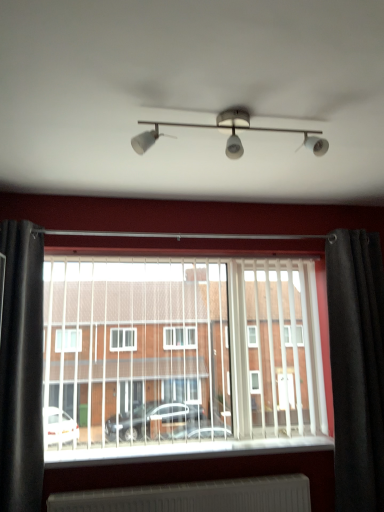
In order to face black fabric curtain at left, the second curtain positioned from the right, should I rotate leftwards or rightwards?

You should look left and rotate roughly 22.227 degrees.

What do you see at coordinates (179, 355) in the screenshot?
I see `white plastic blinds at center` at bounding box center [179, 355].

Image resolution: width=384 pixels, height=512 pixels. What do you see at coordinates (188, 450) in the screenshot?
I see `white plastic window sill at center` at bounding box center [188, 450].

Describe the element at coordinates (357, 367) in the screenshot. The image size is (384, 512). I see `black velvet curtain at right, marked as the first curtain in a right-to-left arrangement` at that location.

At what (x,y) coordinates should I click in order to perform the action: click on black fabric curtain at left, the second curtain positioned from the right. Please return your answer as a coordinate pair (x, y). Looking at the image, I should click on (21, 368).

Is black velvet curtain at right, marked as the first curtain in a right-to-left arrangement, not within white plastic blinds at center?

Yes, black velvet curtain at right, marked as the first curtain in a right-to-left arrangement, is not within white plastic blinds at center.

In order to click on window above the black velvet curtain at right, which ranks as the second curtain in left-to-right order (from the image's perspective) in this screenshot , I will do `click(179, 355)`.

How far apart are black velvet curtain at right, which ranks as the second curtain in left-to-right order, and white plastic blinds at center?

The distance of black velvet curtain at right, which ranks as the second curtain in left-to-right order, from white plastic blinds at center is 29.37 inches.

Based on the photo, are black velvet curtain at right, which ranks as the second curtain in left-to-right order, and white plastic blinds at center far apart?

No, black velvet curtain at right, which ranks as the second curtain in left-to-right order, is not far from white plastic blinds at center.

Image resolution: width=384 pixels, height=512 pixels. Find the location of `curtain on the right side of black fabric curtain at left, the first curtain viewed from the left`. curtain on the right side of black fabric curtain at left, the first curtain viewed from the left is located at coordinates (357, 367).

From the image's perspective, is black fabric curtain at left, the first curtain viewed from the left, beneath black velvet curtain at right, marked as the first curtain in a right-to-left arrangement?

Incorrect, from the image's perspective, black fabric curtain at left, the first curtain viewed from the left, is higher than black velvet curtain at right, marked as the first curtain in a right-to-left arrangement.

Between black fabric curtain at left, the second curtain positioned from the right, and black velvet curtain at right, marked as the first curtain in a right-to-left arrangement, which one has larger width?

With larger width is black velvet curtain at right, marked as the first curtain in a right-to-left arrangement.

In the image, is black fabric curtain at left, the second curtain positioned from the right, positioned in front of or behind black velvet curtain at right, which ranks as the second curtain in left-to-right order?

Clearly, black fabric curtain at left, the second curtain positioned from the right, is in front of black velvet curtain at right, which ranks as the second curtain in left-to-right order.

From the picture: Is black fabric curtain at left, the first curtain viewed from the left, oriented away from satin white track lights at center?

black fabric curtain at left, the first curtain viewed from the left, does not have its back to satin white track lights at center.

Is black fabric curtain at left, the second curtain positioned from the right, thinner than satin white track lights at center?

Incorrect, the width of black fabric curtain at left, the second curtain positioned from the right, is not less than that of satin white track lights at center.

Who is shorter, black fabric curtain at left, the second curtain positioned from the right, or satin white track lights at center?

Standing shorter between the two is satin white track lights at center.

Is satin white track lights at center inside black fabric curtain at left, the second curtain positioned from the right?

No, satin white track lights at center is not a part of black fabric curtain at left, the second curtain positioned from the right.

Locate an element on the screen. The width and height of the screenshot is (384, 512). light fixture above the white plastic blinds at center (from a real-world perspective) is located at coordinates (230, 133).

Could you tell me if white plastic blinds at center is turned towards satin white track lights at center?

Yes, white plastic blinds at center is facing satin white track lights at center.

From the image's perspective, is white plastic blinds at center above or below satin white track lights at center?

Based on their image positions, white plastic blinds at center is located beneath satin white track lights at center.

Based on the photo, is black fabric curtain at left, the first curtain viewed from the left, aimed at white plastic window sill at center?

No, black fabric curtain at left, the first curtain viewed from the left, is not facing towards white plastic window sill at center.

Considering the relative positions of black fabric curtain at left, the second curtain positioned from the right, and white plastic window sill at center in the image provided, is black fabric curtain at left, the second curtain positioned from the right, in front of white plastic window sill at center?

Yes, black fabric curtain at left, the second curtain positioned from the right, is closer to the viewer.

Choose the correct answer: Is black fabric curtain at left, the second curtain positioned from the right, inside white plastic window sill at center or outside it?

black fabric curtain at left, the second curtain positioned from the right, is located beyond the bounds of white plastic window sill at center.

Is white plastic window sill at center positioned beyond the bounds of satin white track lights at center?

Yes, white plastic window sill at center is located beyond the bounds of satin white track lights at center.

What's the angular difference between white plastic window sill at center and satin white track lights at center's facing directions?

0.0667 degrees.

From the image's perspective, which is above, white plastic window sill at center or satin white track lights at center?

satin white track lights at center is shown above in the image.

In terms of width, does black velvet curtain at right, which ranks as the second curtain in left-to-right order, look wider or thinner when compared to satin white track lights at center?

Considering their sizes, black velvet curtain at right, which ranks as the second curtain in left-to-right order, looks broader than satin white track lights at center.

Is black velvet curtain at right, marked as the first curtain in a right-to-left arrangement, far away from satin white track lights at center?

Yes.

From the image's perspective, which one is positioned lower, black velvet curtain at right, marked as the first curtain in a right-to-left arrangement, or satin white track lights at center?

black velvet curtain at right, marked as the first curtain in a right-to-left arrangement, from the image's perspective.

Is black velvet curtain at right, which ranks as the second curtain in left-to-right order, to the right of satin white track lights at center from the viewer's perspective?

Yes.

Where is `window above the black velvet curtain at right, marked as the first curtain in a right-to-left arrangement (from a real-world perspective)`? Image resolution: width=384 pixels, height=512 pixels. window above the black velvet curtain at right, marked as the first curtain in a right-to-left arrangement (from a real-world perspective) is located at coordinates (179, 355).

Locate an element on the screen. curtain in front of the black velvet curtain at right, which ranks as the second curtain in left-to-right order is located at coordinates (21, 368).

When comparing their distances from satin white track lights at center, does white plastic window sill at center or white plastic blinds at center seem closer?

The object closer to satin white track lights at center is white plastic blinds at center.

When comparing their distances from satin white track lights at center, does black velvet curtain at right, which ranks as the second curtain in left-to-right order, or black fabric curtain at left, the second curtain positioned from the right, seem further?

Among the two, black fabric curtain at left, the second curtain positioned from the right, is located further to satin white track lights at center.

Considering their positions, is white plastic window sill at center positioned further to satin white track lights at center than black velvet curtain at right, which ranks as the second curtain in left-to-right order?

Among the two, white plastic window sill at center is located further to satin white track lights at center.

Which object lies nearer to the anchor point white plastic window sill at center, black velvet curtain at right, which ranks as the second curtain in left-to-right order, or satin white track lights at center?

black velvet curtain at right, which ranks as the second curtain in left-to-right order, lies closer to white plastic window sill at center than the other object.

Which object lies further to the anchor point black velvet curtain at right, which ranks as the second curtain in left-to-right order, white plastic blinds at center or black fabric curtain at left, the second curtain positioned from the right?

black fabric curtain at left, the second curtain positioned from the right, lies further to black velvet curtain at right, which ranks as the second curtain in left-to-right order, than the other object.

Looking at the image, which one is located closer to satin white track lights at center, black fabric curtain at left, the second curtain positioned from the right, or white plastic blinds at center?

Among the two, white plastic blinds at center is located nearer to satin white track lights at center.

When comparing their distances from white plastic blinds at center, does white plastic window sill at center or black fabric curtain at left, the second curtain positioned from the right, seem closer?

white plastic window sill at center is closer to white plastic blinds at center.

Which object lies nearer to the anchor point black velvet curtain at right, which ranks as the second curtain in left-to-right order, satin white track lights at center or black fabric curtain at left, the first curtain viewed from the left?

satin white track lights at center.

What are the coordinates of `window between satin white track lights at center and black velvet curtain at right, marked as the first curtain in a right-to-left arrangement, in the vertical direction` in the screenshot? It's located at (179, 355).

This screenshot has height=512, width=384. Find the location of `light fixture situated between black fabric curtain at left, the second curtain positioned from the right, and black velvet curtain at right, which ranks as the second curtain in left-to-right order, from left to right`. light fixture situated between black fabric curtain at left, the second curtain positioned from the right, and black velvet curtain at right, which ranks as the second curtain in left-to-right order, from left to right is located at coordinates [230, 133].

The image size is (384, 512). Find the location of `curtain between satin white track lights at center and white plastic blinds at center from top to bottom`. curtain between satin white track lights at center and white plastic blinds at center from top to bottom is located at coordinates (21, 368).

Identify the location of window between black fabric curtain at left, the second curtain positioned from the right, and white plastic window sill at center, in the horizontal direction. (179, 355).